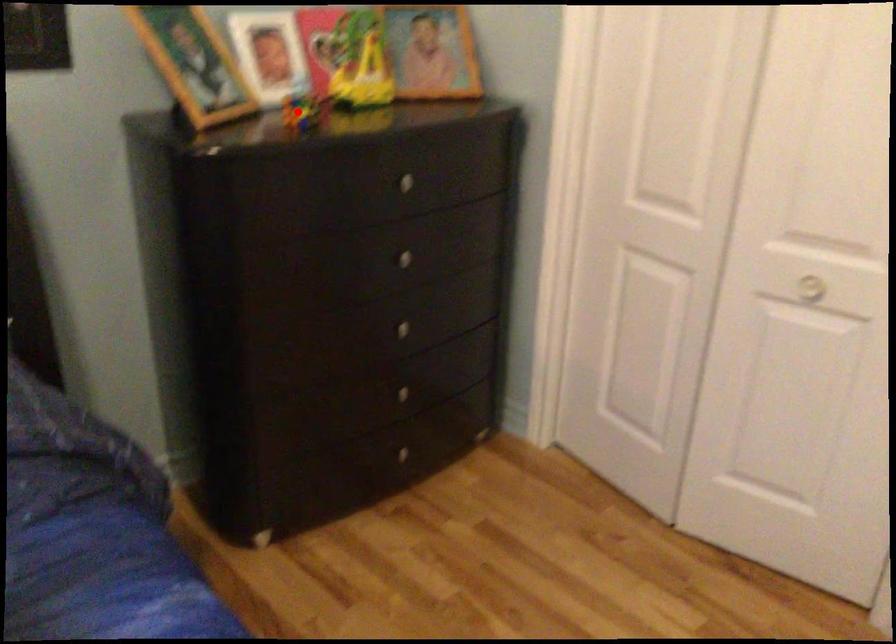
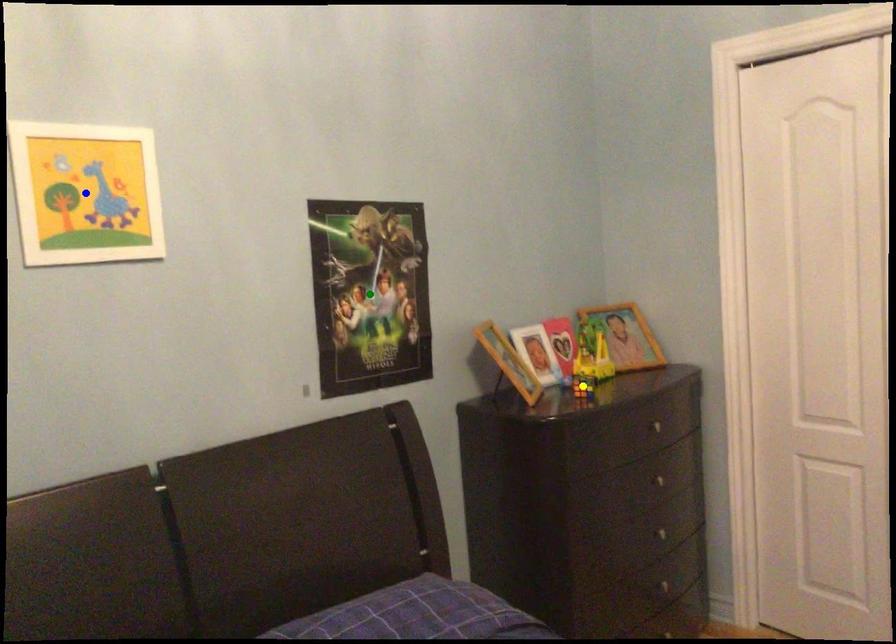
Question: I am providing you with two images of the same scene from different viewpoints. A red point is marked on the first image. You are given multiple points on the second image. Which spot in image 2 lines up with the point in image 1?

Choices:
 (A) green point
 (B) yellow point
 (C) blue point

Answer: (B)